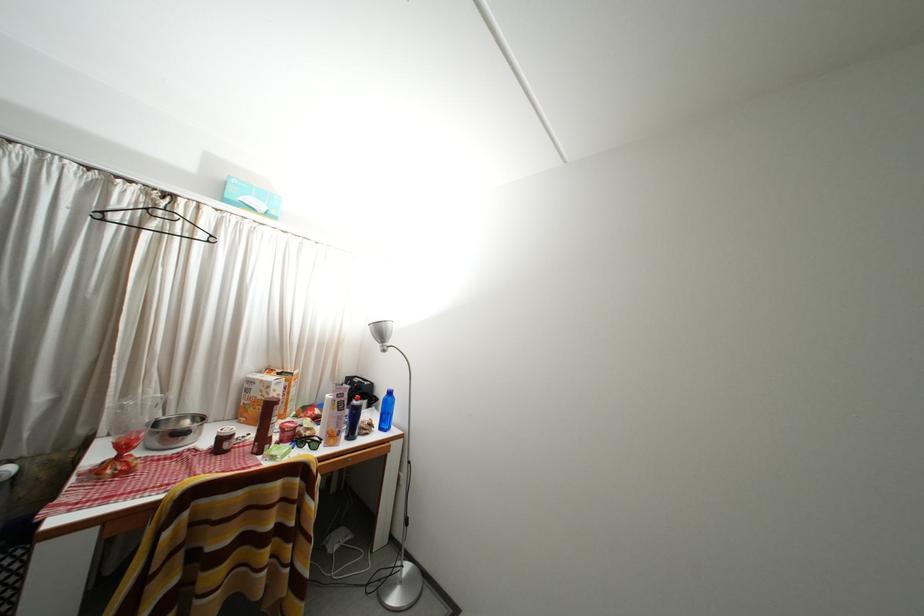
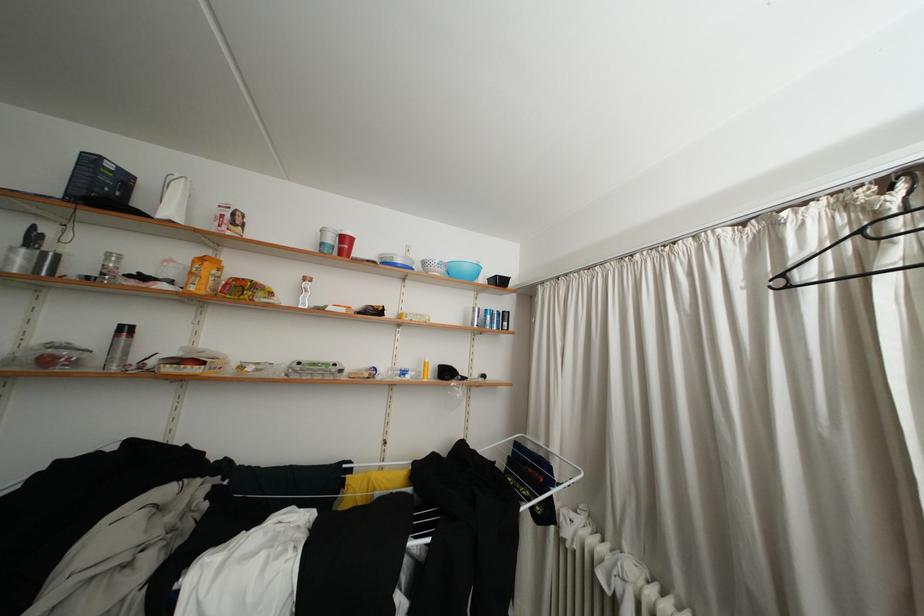
In the second image, find the point that corresponds to (167,217) in the first image.

(906, 229)